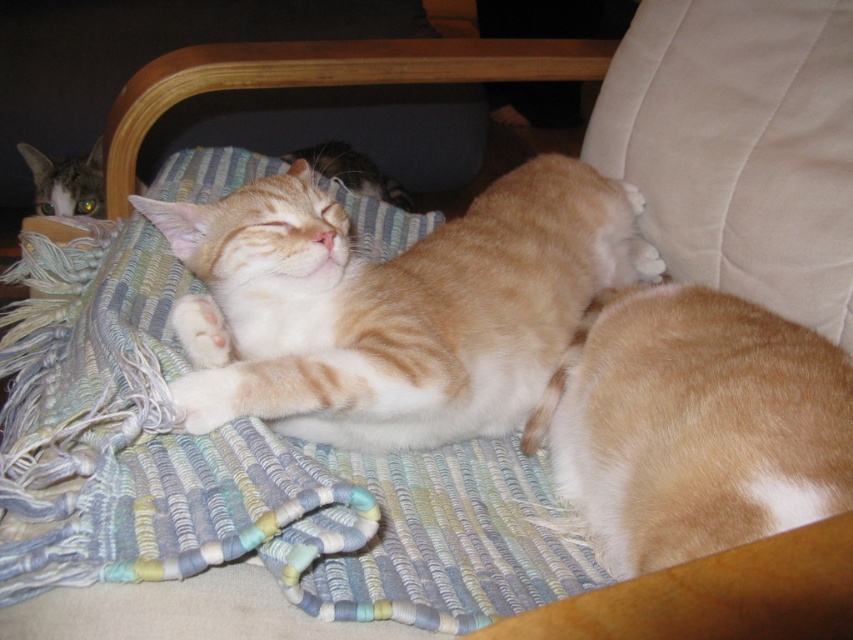
You are a photographer trying to capture a photo of both cats. Since the golden fur cat at center is blocking the view of the tabby fur cat at upper left, can you adjust your position to include both in the frame without moving the cats?

The golden fur cat at center is taller than the tabby fur cat at upper left, so you can lower your camera angle to ensure both cats are visible in the frame by positioning the taller golden fur cat at center in the foreground and the shorter tabby fur cat at upper left in the background.

You are a photographer trying to capture a closeup of the orange tabby cat at center. Given that your camera has a focal length of 50mm and you are currently positioned 2 meters away from the point marked at coordinates point (392, 305), will you need to move closer or farther away to ensure the cat fills the frame properly?

The point (392, 305) marks the orange tabby cat at center. With a 50mm lens, to fill the frame with the cat, you would typically need the subject to occupy about 60 percent of the frame. At 2 meters distance, the cat may appear too small. Moving closer to approximately 1.5 meters would bring the cat into a better focus and fill the frame appropriately without overcropping.

You are a cat owner who wants to place a small toy between the golden fur cat at center and the orange fur cat at center so both can play. The toy requires a minimum of 75 centimeters of space to be placed. Can you fit the toy between them?

The golden fur cat at center and orange fur cat at center are 84.03 centimeters apart from each other, which is more than the required 75 centimeters. Therefore, the toy can be placed between them.